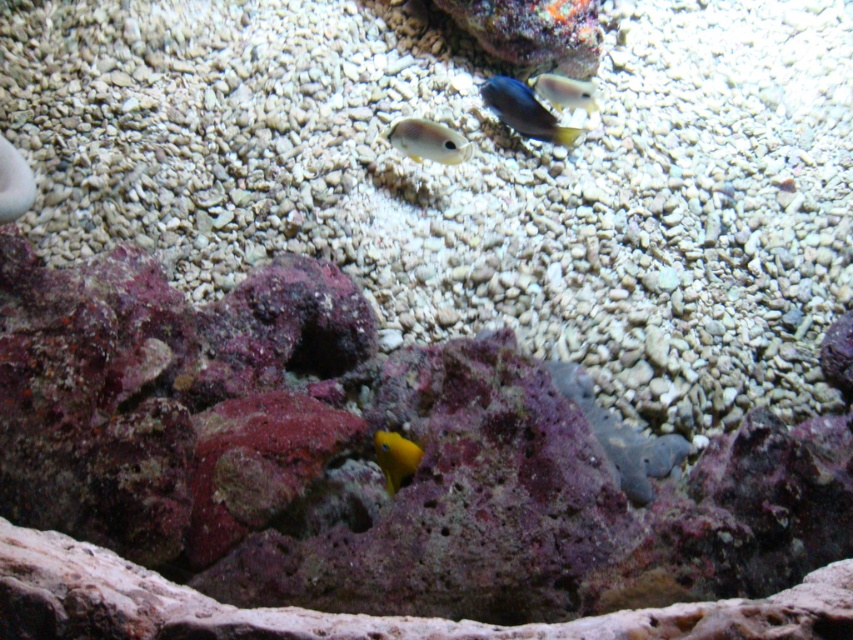
The image size is (853, 640). Find the location of `translucent yellow fish at center`. translucent yellow fish at center is located at coordinates (428, 140).

Does translucent yellow fish at center appear under yellow matte fish at center?

Actually, translucent yellow fish at center is above yellow matte fish at center.

Who is more distant from viewer, (428,122) or (416,452)?

Point (428,122)

At what (x,y) coordinates should I click in order to perform the action: click on translucent yellow fish at center. Please return your answer as a coordinate pair (x, y). The width and height of the screenshot is (853, 640). Looking at the image, I should click on (428, 140).

Does blue glossy fish at center appear over translucent white fish at center?

Incorrect, blue glossy fish at center is not positioned above translucent white fish at center.

Is blue glossy fish at center bigger than translucent white fish at center?

Correct, blue glossy fish at center is larger in size than translucent white fish at center.

What are the coordinates of `blue glossy fish at center` in the screenshot? It's located at (524, 112).

Which of these two, blue glossy fish at center or translucent yellow fish at center, stands taller?

blue glossy fish at center is taller.

Between blue glossy fish at center and translucent yellow fish at center, which one is positioned higher?

blue glossy fish at center is higher up.

You are a GUI agent. You are given a task and a screenshot of the screen. Output one action in this format:
    pyautogui.click(x=<x>, y=<y>)
    Task: Click on the blue glossy fish at center
    This screenshot has width=853, height=640.
    Given the screenshot: What is the action you would take?
    pyautogui.click(x=524, y=112)